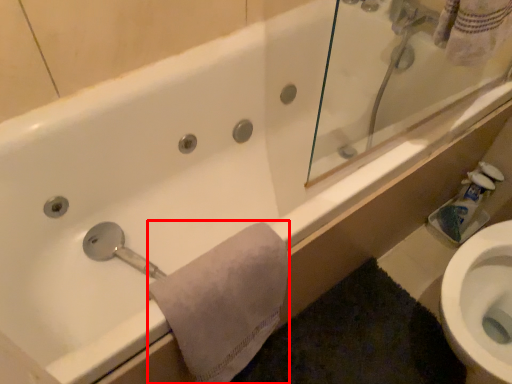
Question: Observing the image, what is the correct spatial positioning of bath towel (annotated by the red box) in reference to toilet paper?

Choices:
 (A) left
 (B) right

Answer: (A)